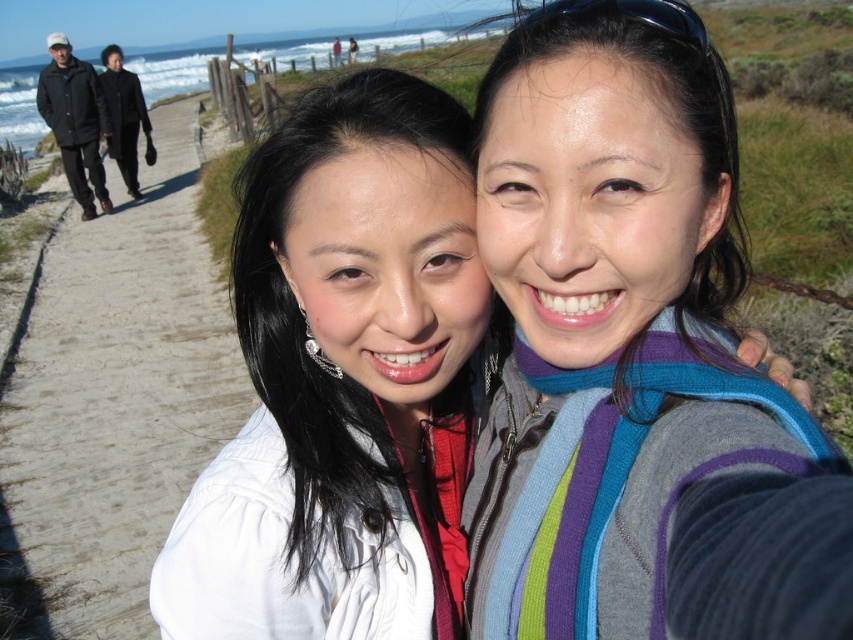
Does white matte jacket at center appear under brown dirt path at center?

Correct, white matte jacket at center is located below brown dirt path at center.

Is white matte jacket at center in front of brown dirt path at center?

Yes, white matte jacket at center is in front of brown dirt path at center.

Does point (399, 177) come farther from viewer compared to point (4, 460)?

No, (399, 177) is closer to viewer.

Where is `white matte jacket at center`? The image size is (853, 640). white matte jacket at center is located at coordinates coord(344,381).

Is brown dirt path at center positioned behind black matte jacket at upper left?

No.

This screenshot has height=640, width=853. Find the location of `brown dirt path at center`. brown dirt path at center is located at coordinates (119, 396).

Is white matte jacket at center above black matte jacket at upper left?

No, white matte jacket at center is not above black matte jacket at upper left.

Identify the location of white matte jacket at center. click(x=344, y=381).